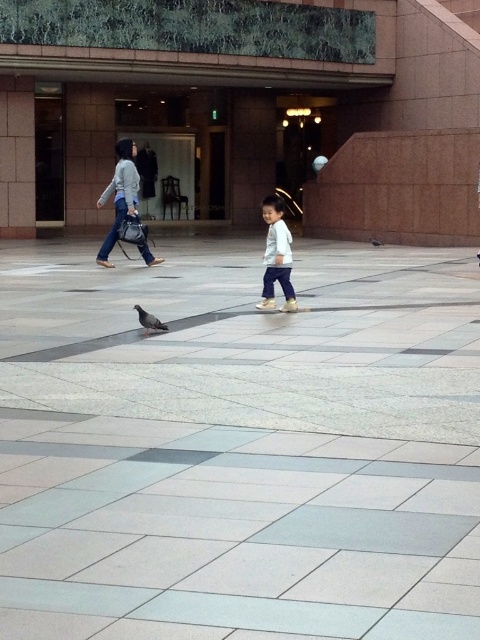
Who is higher up, brown marble mall at center or light gray fleece jacket at center?

brown marble mall at center

Identify the location of brown marble mall at center. (247, 109).

Which is behind, point (283, 147) or point (284, 294)?

Point (283, 147)

Image resolution: width=480 pixels, height=640 pixels. What are the coordinates of `brown marble mall at center` in the screenshot? It's located at (247, 109).

What do you see at coordinates (276, 256) in the screenshot? The image size is (480, 640). I see `light gray fleece jacket at center` at bounding box center [276, 256].

The image size is (480, 640). I want to click on light gray fleece jacket at center, so click(276, 256).

Is brown marble mall at center smaller than matte gray sweater at upper left?

Actually, brown marble mall at center might be larger than matte gray sweater at upper left.

Measure the distance from brown marble mall at center to matte gray sweater at upper left.

A distance of 18.42 feet exists between brown marble mall at center and matte gray sweater at upper left.

Identify the location of brown marble mall at center. The image size is (480, 640). (247, 109).